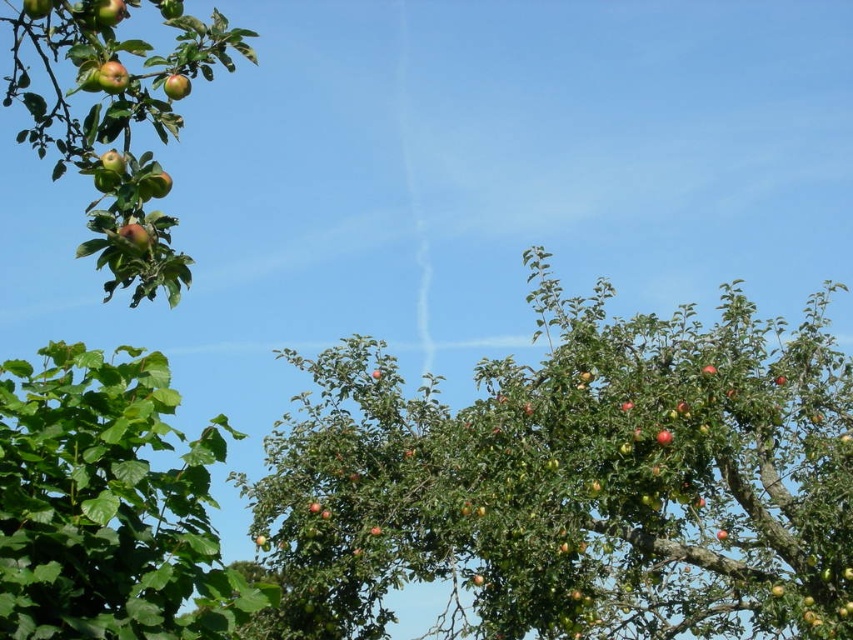
Question: Is green leafy tree at left thinner than shiny green apples at upper left?

Choices:
 (A) yes
 (B) no

Answer: (A)

Question: Which object is the farthest from the green matte tree at center?

Choices:
 (A) glossy red apple at upper left
 (B) shiny red apple at upper left

Answer: (B)

Question: Is green leafy tree at left behind shiny red apple at upper left?

Choices:
 (A) no
 (B) yes

Answer: (A)

Question: Which is farther from the glossy red apple at upper left?

Choices:
 (A) green matte tree at center
 (B) shiny red apple at upper left
 (C) green leafy tree at left

Answer: (A)

Question: Does green leafy tree at left appear over shiny red apple at upper left?

Choices:
 (A) no
 (B) yes

Answer: (A)

Question: Which point is farther to the camera?

Choices:
 (A) (102, 83)
 (B) (9, 93)

Answer: (B)